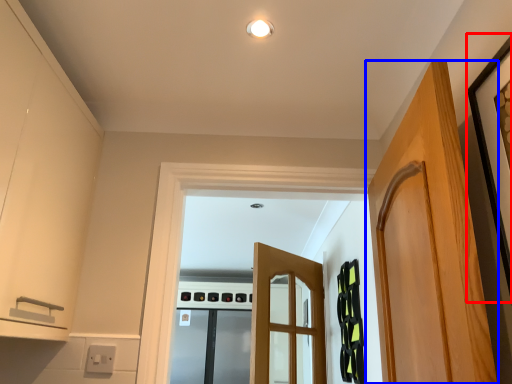
Question: Which point is closer to the camera, picture frame (highlighted by a red box) or door (highlighted by a blue box)?

Choices:
 (A) picture frame
 (B) door

Answer: (A)